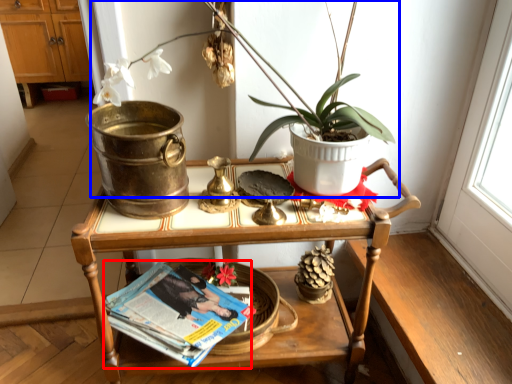
Question: Which of the following is the farthest to the observer, magazine (highlighted by a red box) or houseplant (highlighted by a blue box)?

Choices:
 (A) magazine
 (B) houseplant

Answer: (A)